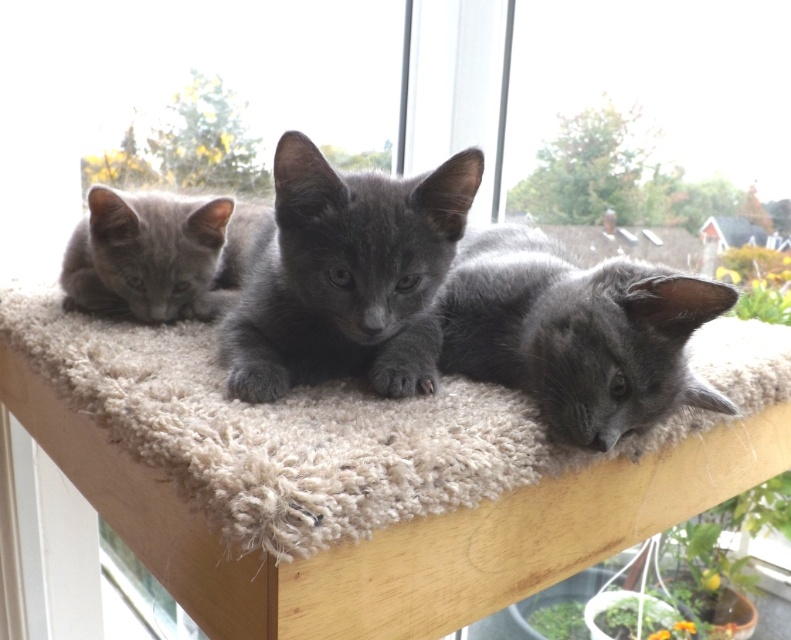
Which is behind, point (209, 371) or point (85, 225)?

Point (85, 225)

You are a GUI agent. You are given a task and a screenshot of the screen. Output one action in this format:
    pyautogui.click(x=<x>, y=<y>)
    Task: Click on the beige shaggy carpet at center
    This screenshot has height=640, width=791.
    Given the screenshot: What is the action you would take?
    pyautogui.click(x=294, y=432)

Can you confirm if beige shaggy carpet at center is shorter than shiny black kitten at center?

Yes, beige shaggy carpet at center is shorter than shiny black kitten at center.

Can you confirm if beige shaggy carpet at center is wider than shiny black kitten at center?

Yes, beige shaggy carpet at center is wider than shiny black kitten at center.

Where is `beige shaggy carpet at center`? The height and width of the screenshot is (640, 791). beige shaggy carpet at center is located at coordinates (294, 432).

Is shiny black kitten at center thinner than shiny gray kitten at center?

Yes, shiny black kitten at center is thinner than shiny gray kitten at center.

Does shiny black kitten at center have a greater height compared to shiny gray kitten at center?

Incorrect, shiny black kitten at center's height is not larger of shiny gray kitten at center's.

This screenshot has height=640, width=791. Describe the element at coordinates (346, 276) in the screenshot. I see `shiny black kitten at center` at that location.

The width and height of the screenshot is (791, 640). What are the coordinates of `shiny black kitten at center` in the screenshot? It's located at (346, 276).